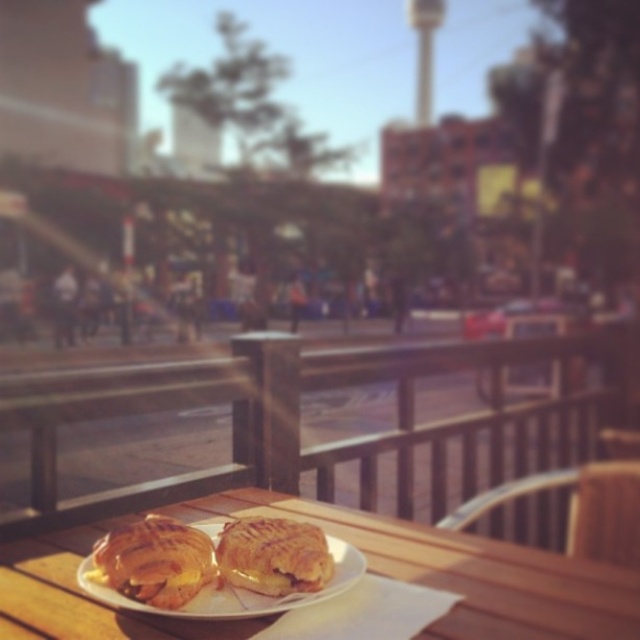
From the picture: You are a photographer standing at the camera position and want to take a photo of the point at coordinates point (573, 632). If your camera has a minimum focus distance of 25 inches, will you be able to focus on the point?

The point (573, 632) is 24.75 inches away from the camera, which is less than the minimum focus distance of 25 inches. Therefore, the camera cannot focus on the point.

You are standing at the edge of the outdoor cafe and want to walk towards the two points marked in the image. Which point, point (x=156, y=566) or point (x=205, y=524), will you reach first?

Point (x=156, y=566) is closer to the viewer than point (x=205, y=524), so you will reach point (x=156, y=566) first.

You are standing at the viewer position in the outdoor cafe scene. There is a point at coordinates point (x=184, y=570). If you want to place a small vase there, will it be visible to someone sitting at the wooden table with the white plate? Please explain.

The point (x=184, y=570) is 25.91 inches away from the viewer. Since the wooden table with the white plate is in the foreground and the point is relatively close to the viewer, the vase placed there would likely be visible to someone sitting at the table.